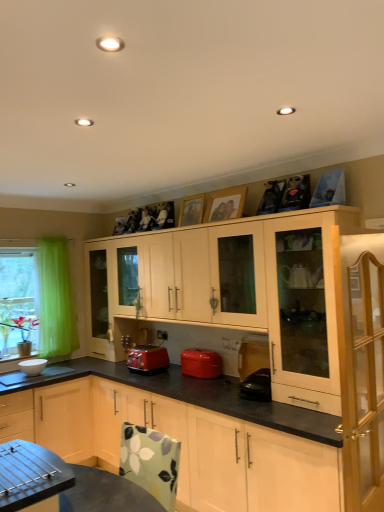
This screenshot has width=384, height=512. Find the location of `free space above white glossy bowl at lower left (from a real-world perspective)`. free space above white glossy bowl at lower left (from a real-world perspective) is located at coordinates (46, 368).